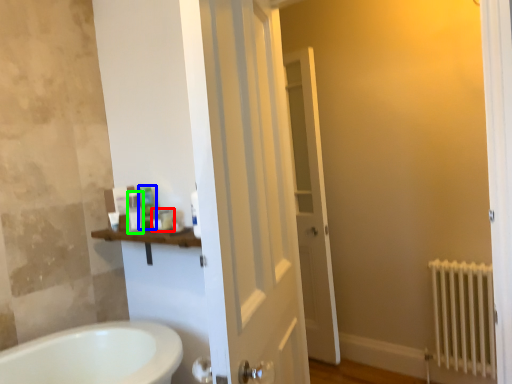
Question: Which object is the closest to the toiletry (highlighted by a red box)? Choose among these: toiletry (highlighted by a blue box) or toiletry (highlighted by a green box).

Choices:
 (A) toiletry
 (B) toiletry

Answer: (A)